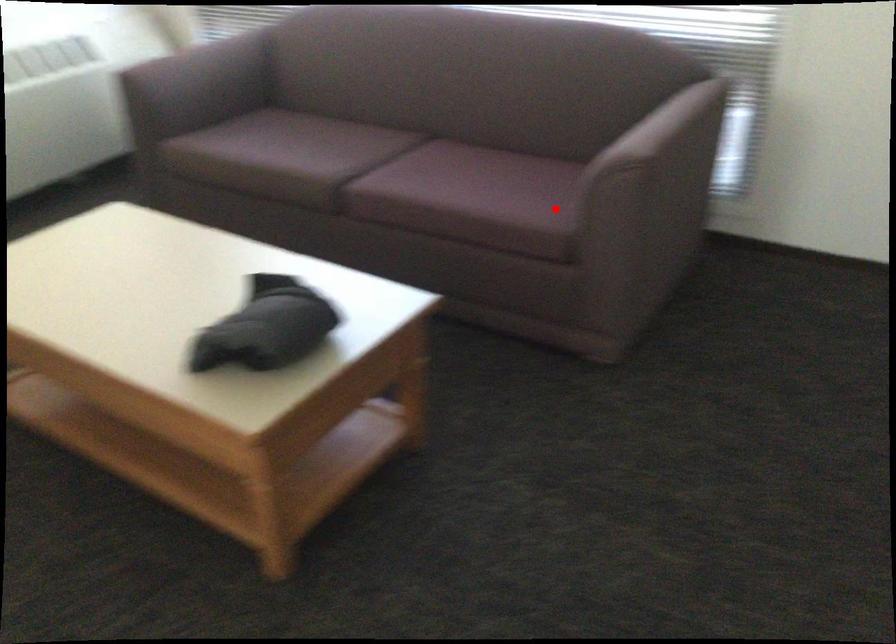
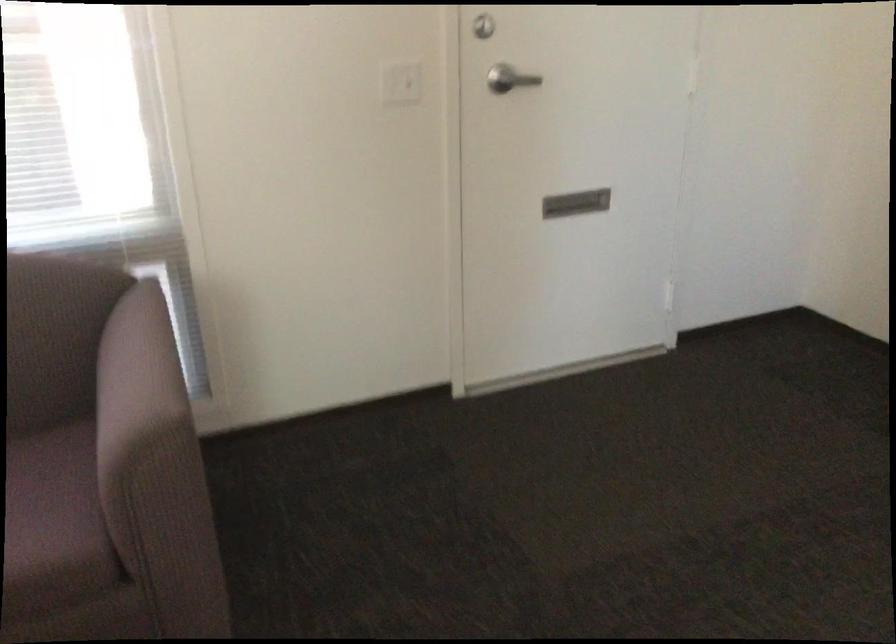
In the second image, find the point that corresponds to the highlighted location in the first image.

(53, 520)